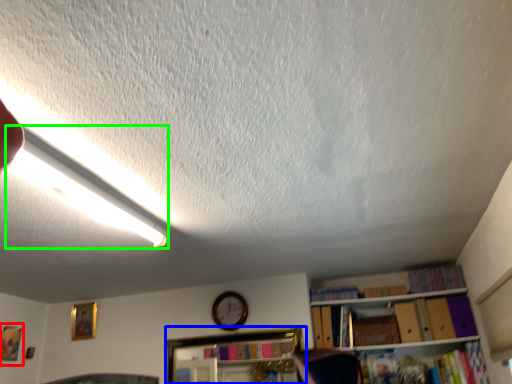
Question: Based on their relative distances, which object is farther from picture frame (highlighted by a red box)? Choose from shelf (highlighted by a blue box) and light (highlighted by a green box).

Choices:
 (A) shelf
 (B) light

Answer: (B)